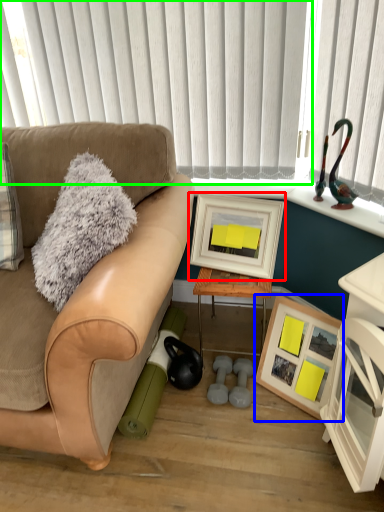
Question: Which is farther away from picture frame (highlighted by a red box)? picture frame (highlighted by a blue box) or blind (highlighted by a green box)?

Choices:
 (A) picture frame
 (B) blind

Answer: (B)